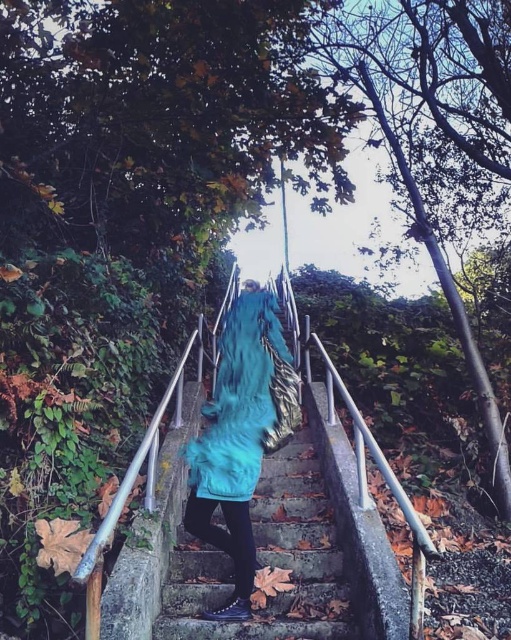
Which is more to the left, stone textured stairs at center or teal fuzzy coat at center?

Positioned to the left is teal fuzzy coat at center.

Between stone textured stairs at center and teal fuzzy coat at center, which one is positioned lower?

stone textured stairs at center

Where is `stone textured stairs at center`? stone textured stairs at center is located at coordinates (281, 564).

At what (x,y) coordinates should I click in order to perform the action: click on stone textured stairs at center. Please return your answer as a coordinate pair (x, y). The width and height of the screenshot is (511, 640). Looking at the image, I should click on (281, 564).